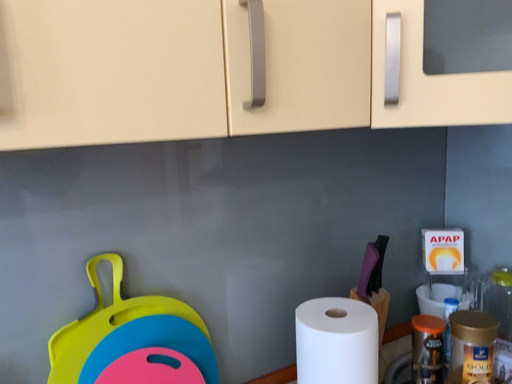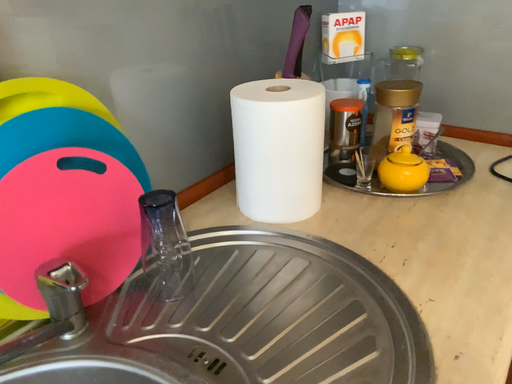
Question: How did the camera likely rotate when shooting the video?

Choices:
 (A) rotated left
 (B) rotated right

Answer: (B)